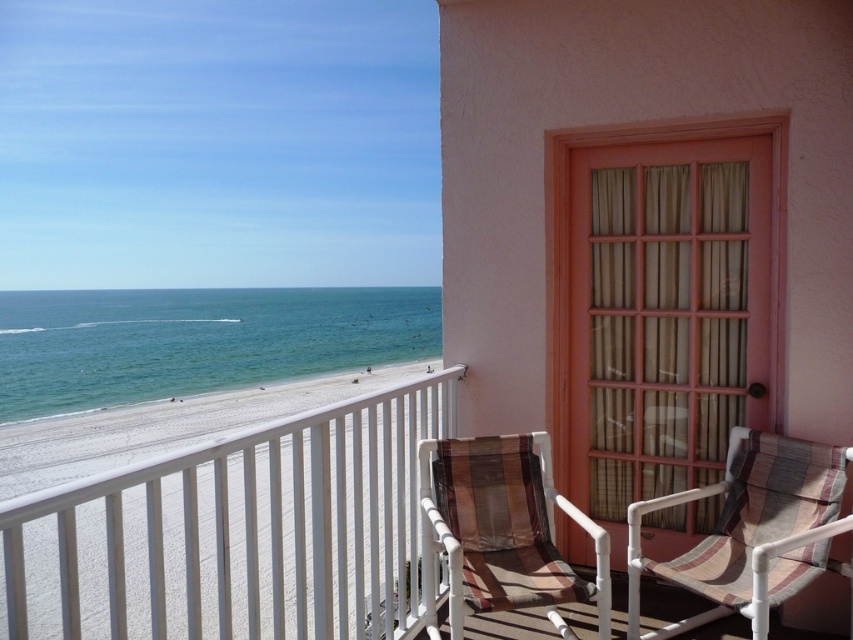
You are standing on the balcony and want to know if the blue water at lower left is wider than the brown striped fabric beach chair at center. Can you confirm this?

The blue water at lower left is wider than the brown striped fabric beach chair at center according to the description.

You are standing on the beachfront balcony and want to place a small potted plant on the balcony floor. The plant requires a spot that is not blocked by the white plastic balustrade at lower left or the brown striped fabric beach chair at center. Based on their heights, which object might cast a shadow over the plant if placed directly in front of it?

The white plastic balustrade at lower left is much taller than the brown striped fabric beach chair at center, so it would cast a larger shadow over the plant if placed in front of it.

You are standing on the beachfront balcony and want to place a small potted plant between the two points labeled point (x=283, y=474) and point (x=256, y=337). Based on their positions, which point should the plant be closer to?

The plant should be placed closer to point (x=256, y=337) because point (x=283, y=474) is in front of point (x=256, y=337), meaning the latter is further back.